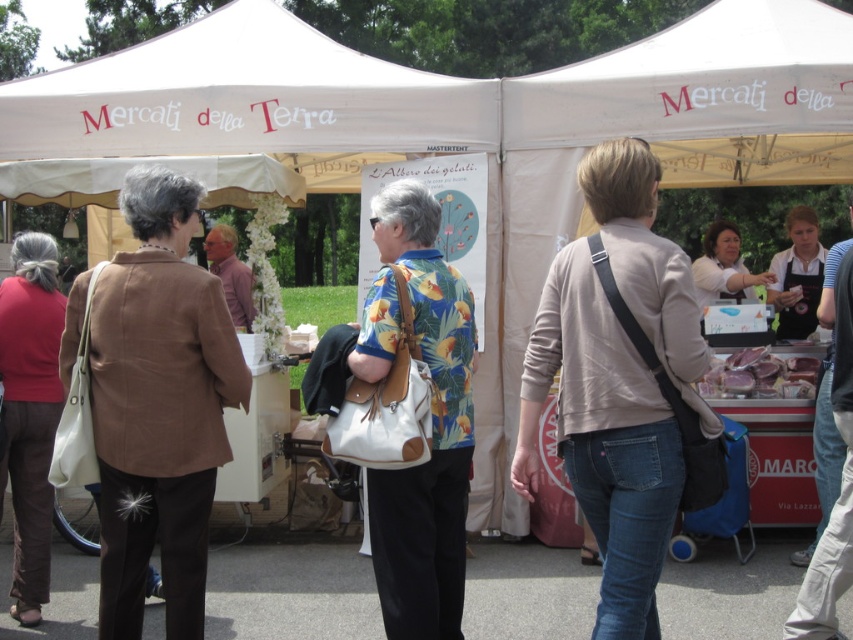
You are a photographer trying to capture the market scene. You want to ensure that both the light brown leather jacket at center and the black apron at right are visible in your photo. Given their heights, which object should you focus on to ensure both are in frame without cropping?

The light brown leather jacket at center is taller than the black apron at right. To ensure both are visible without cropping, focus on the taller object, the light brown leather jacket at center, and adjust the frame accordingly.

You are standing at the entrance of the market and want to reach the two points marked in the image. Which point, point (784, 292) or point (775, 369), is closer to you?

Point (784, 292) is closer to you because it is further to the viewer than point (775, 369).

You are a vendor at the market and need to locate your black apron at right. From your position at the light brown leather jacket at center, in which direction should you look to find it?

The black apron at right is above the light brown leather jacket at center, so you should look upward to find it.